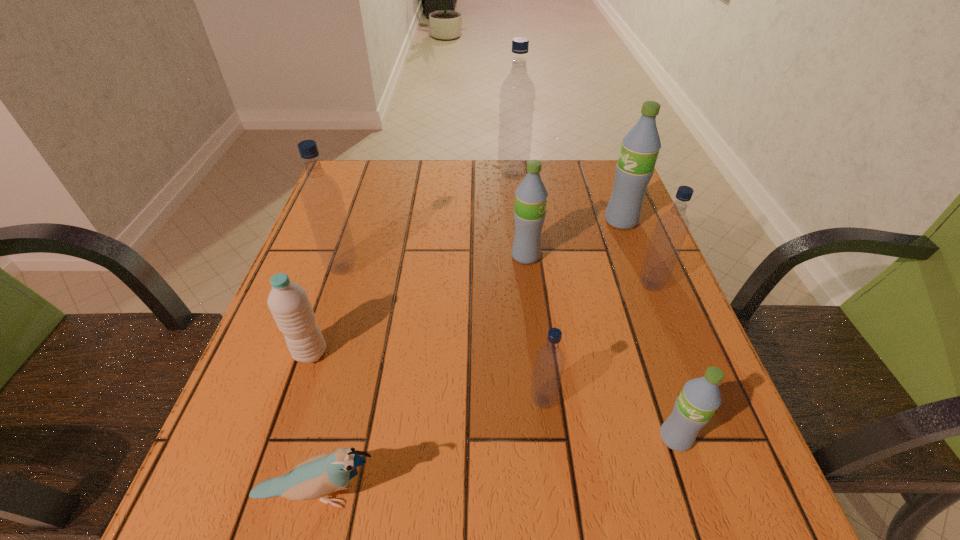
Locate an element on the screen. This screenshot has height=540, width=960. vacant space located on the front of the rightmost blue water bottle is located at coordinates 708,429.

At what (x,y) coordinates should I click in order to perform the action: click on vacant space located on the right of the sixth farthest water bottle. Please return your answer as a coordinate pair (x, y). This screenshot has height=540, width=960. Looking at the image, I should click on (472, 353).

Locate an element on the screen. free region located on the back of the smallest blue water bottle is located at coordinates (535, 330).

In order to click on vacant space located 0.070m on the back of the smallest green water bottle in this screenshot , I will do `click(658, 386)`.

Find the location of a particular element. This screenshot has width=960, height=540. vacant space positioned at the face of the blue bird is located at coordinates (586, 496).

The width and height of the screenshot is (960, 540). I want to click on object at the far edge, so click(517, 94).

The height and width of the screenshot is (540, 960). I want to click on object situated at the near edge, so click(318, 476).

You are a GUI agent. You are given a task and a screenshot of the screen. Output one action in this format:
    pyautogui.click(x=<x>, y=<y>)
    Task: Click on the bird positioned at the left edge
    The height and width of the screenshot is (540, 960).
    Given the screenshot: What is the action you would take?
    pyautogui.click(x=318, y=476)

I want to click on object that is at the near left corner, so click(318, 476).

Locate an element on the screen. Image resolution: width=960 pixels, height=540 pixels. vacant space at the far edge of the desktop is located at coordinates (442, 177).